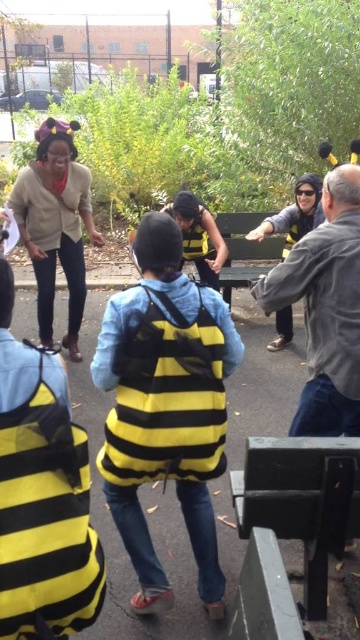
You are a photographer trying to capture a photo of the gray woolen jacket at upper right and the yellow and black costume at center. Which object should you focus on first if you want to ensure both are in the frame without moving the camera?

The gray woolen jacket at upper right is much taller than the yellow and black costume at center, so you should focus on the taller object first to ensure it fits within the frame.

You are a photographer trying to capture both the gray woolen jacket at upper right and the yellow and black costume at center in a single frame. Since you can only focus on one object at a time, which object should you focus on to ensure it appears larger in the photo?

You should focus on the yellow and black costume at center because it is larger than the gray woolen jacket at upper right.